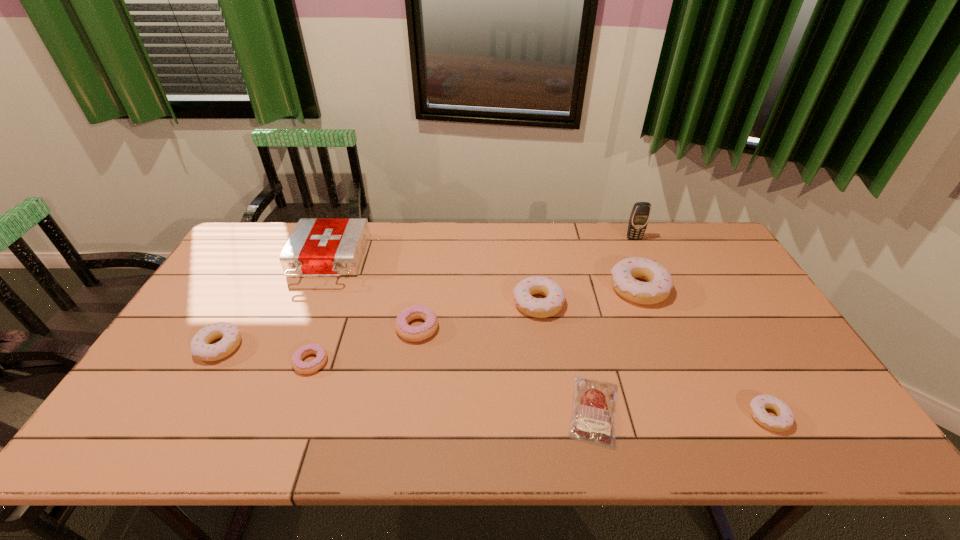
Locate an element on the screen. The image size is (960, 540). vacant space situated 0.210m on the right of the leftmost object is located at coordinates (320, 347).

You are a GUI agent. You are given a task and a screenshot of the screen. Output one action in this format:
    pyautogui.click(x=<x>, y=<y>)
    Task: Click on the vacant space located on the right of the smaller pink doughnut
    This screenshot has width=960, height=540.
    Given the screenshot: What is the action you would take?
    pyautogui.click(x=409, y=362)

Locate an element on the screen. The height and width of the screenshot is (540, 960). vacant region located 0.120m on the right of the rightmost object is located at coordinates (839, 416).

Where is `free space located 0.200m on the right of the shortest object`? free space located 0.200m on the right of the shortest object is located at coordinates point(709,410).

Where is `cellular telephone that is at the far edge`? cellular telephone that is at the far edge is located at coordinates (640, 214).

Where is `the first-aid kit that is at the far edge`? The image size is (960, 540). the first-aid kit that is at the far edge is located at coordinates (317, 246).

Where is `doughnut present at the near edge`? This screenshot has width=960, height=540. doughnut present at the near edge is located at coordinates (785, 417).

Find the location of a particular element. This screenshot has width=960, height=540. steak located at the near edge is located at coordinates (592, 421).

Locate an element on the screen. object at the left edge is located at coordinates (200, 346).

In order to click on object at the right edge in this screenshot , I will do `click(785, 417)`.